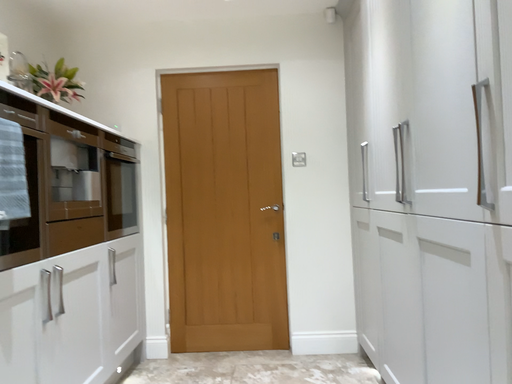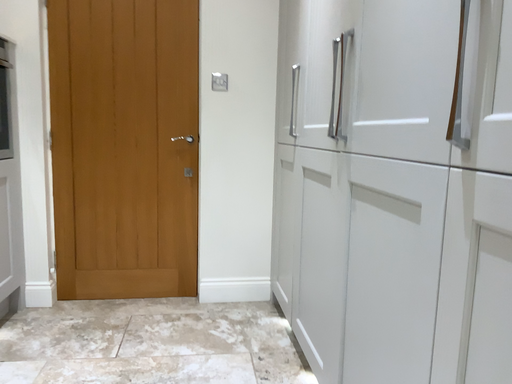
Question: Which way did the camera rotate in the video?

Choices:
 (A) rotated upward
 (B) rotated downward

Answer: (B)